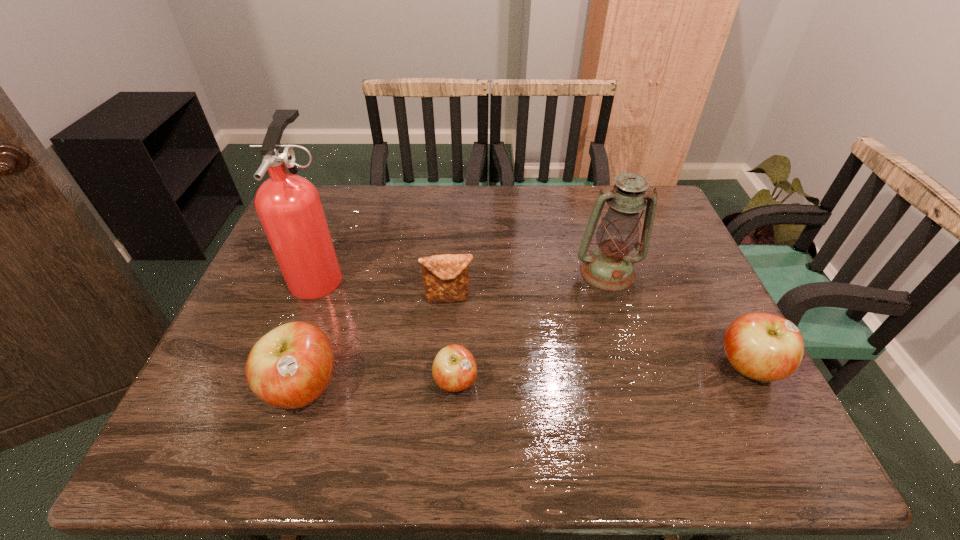
In order to click on vacant space located 0.070m on the right of the shortest object in this screenshot , I will do `click(509, 381)`.

The height and width of the screenshot is (540, 960). I want to click on vacant space located 0.160m on the left of the second tallest apple, so click(645, 368).

Find the location of a particular element. The width and height of the screenshot is (960, 540). free region located 0.060m on the open side of the clutch bag is located at coordinates (447, 326).

Identify the location of free space located 0.300m on the front of the tallest object. Image resolution: width=960 pixels, height=540 pixels. (268, 409).

You are a GUI agent. You are given a task and a screenshot of the screen. Output one action in this format:
    pyautogui.click(x=<x>, y=<y>)
    Task: Click on the vacant position located on the left of the second tallest object
    This screenshot has height=540, width=960.
    Given the screenshot: What is the action you would take?
    pyautogui.click(x=459, y=272)

Locate an element on the screen. apple located at the left edge is located at coordinates (290, 367).

Locate an element on the screen. fire extinguisher present at the left edge is located at coordinates (289, 207).

Where is `apple that is positioned at the right edge`? The height and width of the screenshot is (540, 960). apple that is positioned at the right edge is located at coordinates (765, 347).

At what (x,y) coordinates should I click in order to perform the action: click on oil lamp situated at the right edge. Please return your answer as a coordinate pair (x, y). The height and width of the screenshot is (540, 960). Looking at the image, I should click on (609, 267).

At what (x,y) coordinates should I click in order to perform the action: click on object at the near left corner. Please return your answer as a coordinate pair (x, y). This screenshot has height=540, width=960. Looking at the image, I should click on (290, 367).